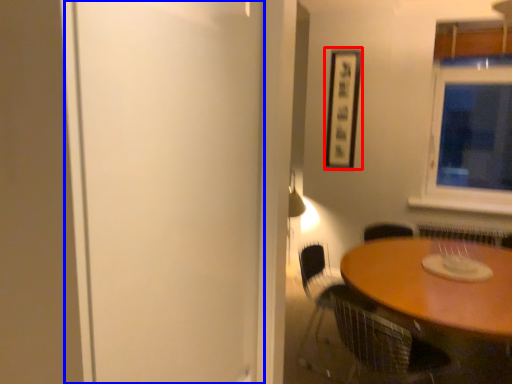
Question: Which of the following is the farthest to the observer, picture frame (highlighted by a red box) or screen door (highlighted by a blue box)?

Choices:
 (A) picture frame
 (B) screen door

Answer: (A)